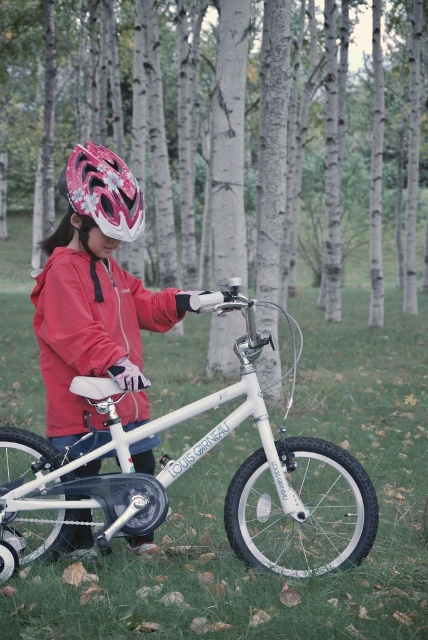
Is point (62, 54) more distant than point (80, 180)?

Yes, it is behind point (80, 180).

Is white smooth tree at center taller than shiny pink helmet at upper center?

Yes, white smooth tree at center is taller than shiny pink helmet at upper center.

Identify the location of white smooth tree at center. This screenshot has height=640, width=428. (143, 122).

How far apart are matte red jacket at center and shiny pink helmet at upper center?

18.38 inches

Looking at this image, how much distance is there between matte red jacket at center and shiny pink helmet at upper center?

The distance of matte red jacket at center from shiny pink helmet at upper center is 18.38 inches.

Locate an element on the screen. The height and width of the screenshot is (640, 428). matte red jacket at center is located at coordinates (89, 330).

Who is taller, white smooth tree at center or matte red jacket at center?

Standing taller between the two is white smooth tree at center.

Is point (21, 152) positioned after point (82, 269)?

Yes, point (21, 152) is behind point (82, 269).

The height and width of the screenshot is (640, 428). I want to click on white smooth tree at center, so click(x=143, y=122).